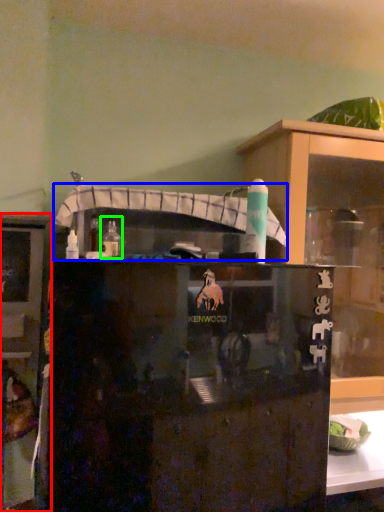
Question: Which object is positioned farthest from cabinetry (highlighted by a red box)? Select from shelf (highlighted by a blue box) and bottle (highlighted by a green box).

Choices:
 (A) shelf
 (B) bottle

Answer: (B)